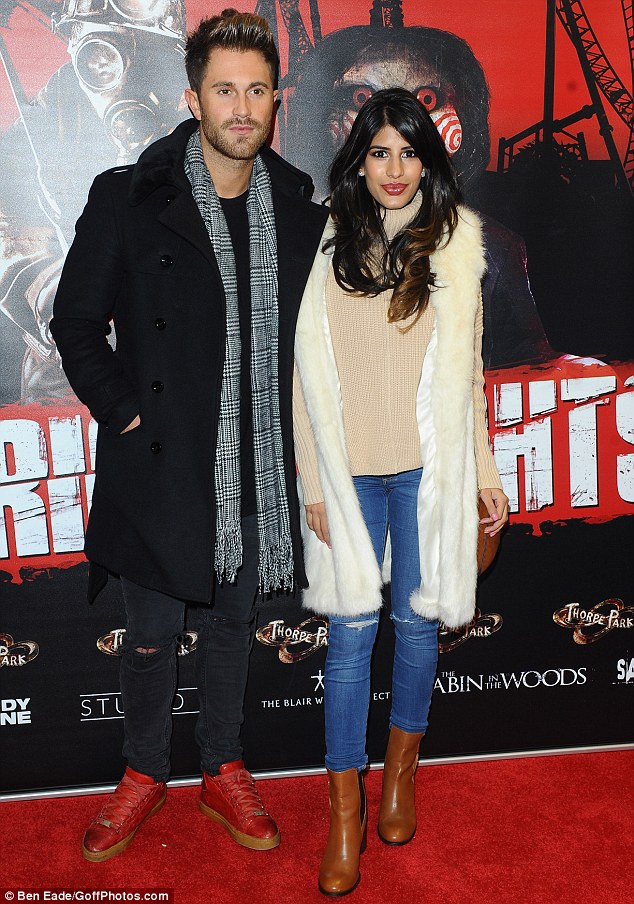
Where is `wall`? wall is located at coordinates (552, 268).